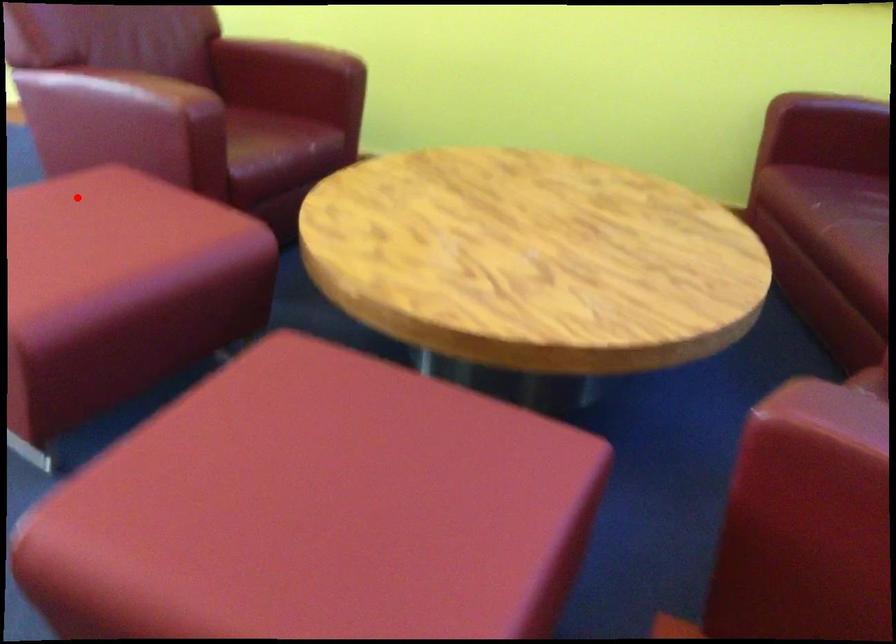
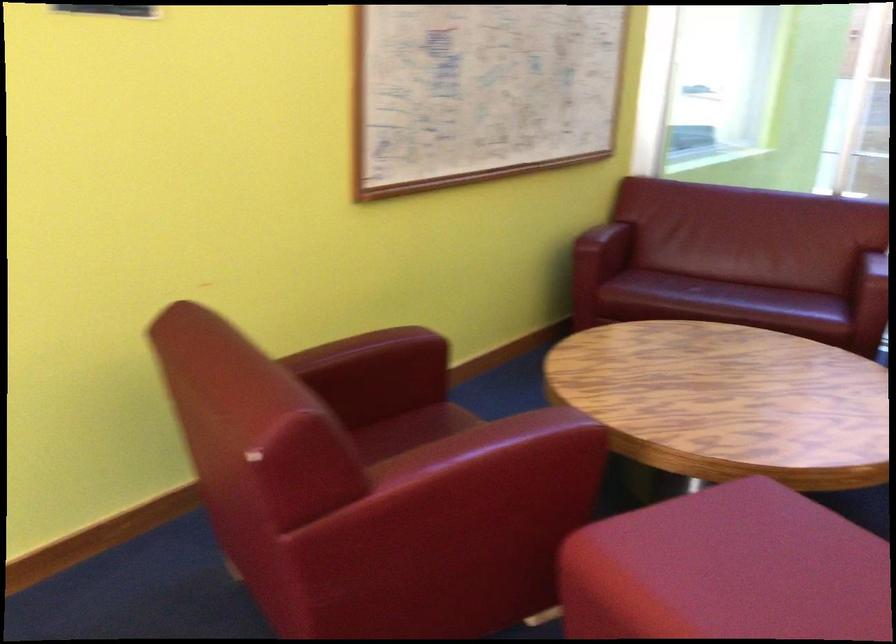
Locate, in the second image, the point that corresponds to the highlighted location in the first image.

(727, 570)